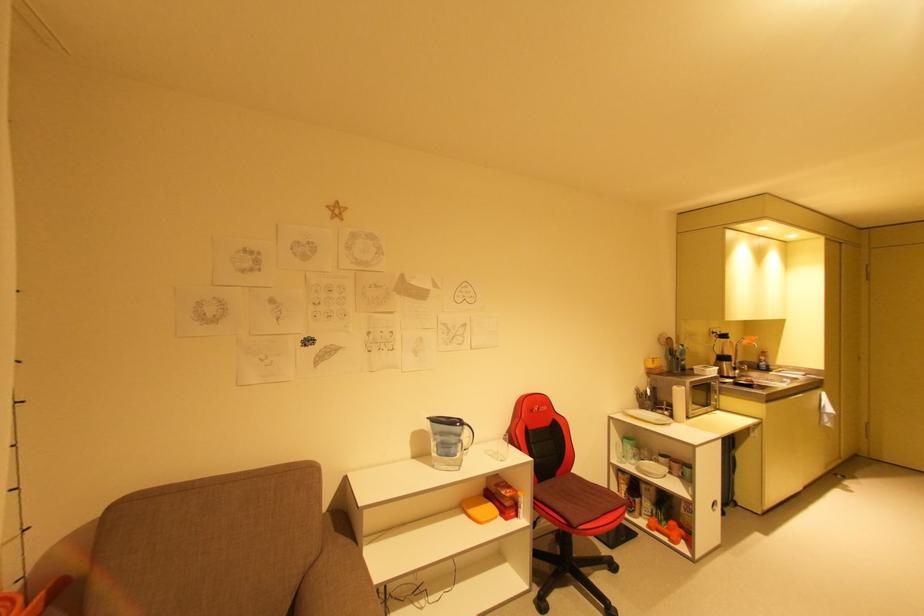
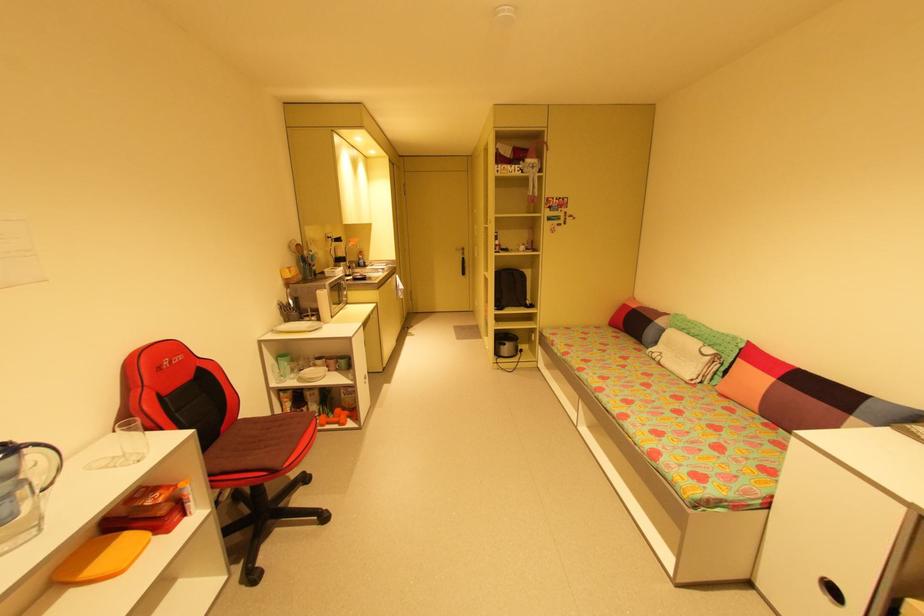
Question: I am providing you with two images of the same scene from different viewpoints. Which of the following objects are not visible in image2?

Choices:
 (A) sofa sitting surface
 (B) green ceramic cup
 (C) white drawer handle
 (D) none of these

Answer: (D)